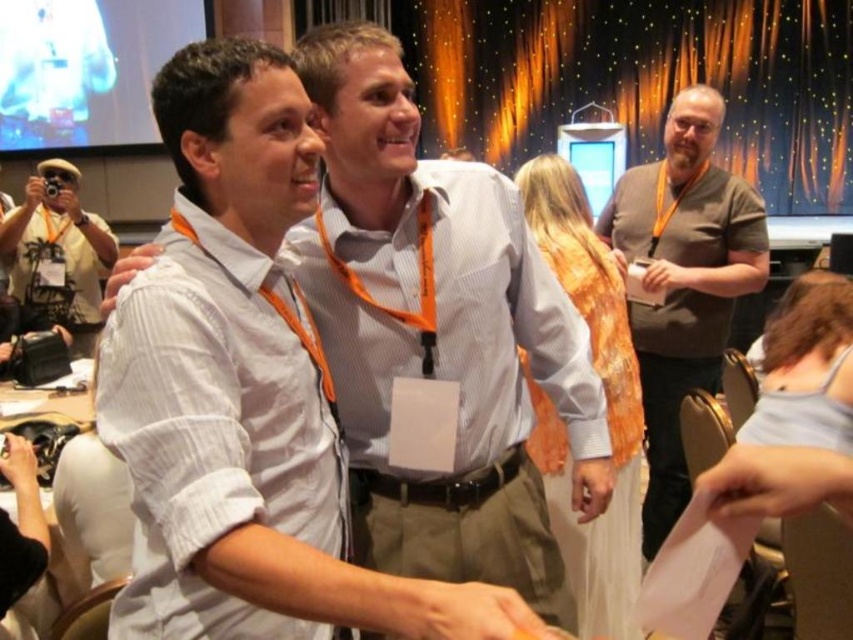
Which is above, white shirt at center or matte black camera at left?

Positioned higher is matte black camera at left.

The height and width of the screenshot is (640, 853). In order to click on white shirt at center in this screenshot , I will do `click(439, 333)`.

Looking at this image, between white shirt at center and matte gray shirt at center, which one appears on the right side from the viewer's perspective?

matte gray shirt at center is more to the right.

Between white shirt at center and matte gray shirt at center, which one is positioned higher?

Positioned higher is matte gray shirt at center.

Is point (375, 333) in front of point (656, 339)?

Yes, it is.

Where is `white shirt at center`? Image resolution: width=853 pixels, height=640 pixels. white shirt at center is located at coordinates (439, 333).

Which is behind, point (672, 168) or point (28, 244)?

The point (28, 244) is behind.

The image size is (853, 640). Find the location of `matte gray shirt at center`. matte gray shirt at center is located at coordinates (x=683, y=282).